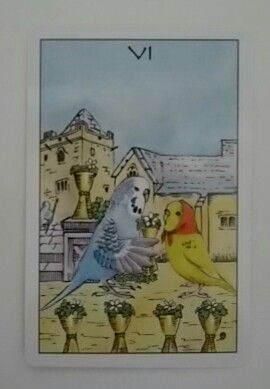
Find the location of a particular element. stairs is located at coordinates (49, 235).